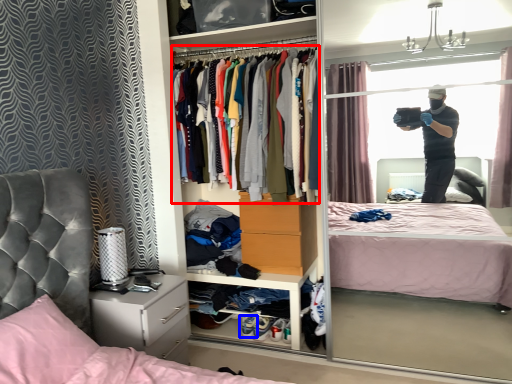
Question: Which of the following is the closest to the observer, clothing (highlighted by a red box) or footwear (highlighted by a blue box)?

Choices:
 (A) clothing
 (B) footwear

Answer: (A)